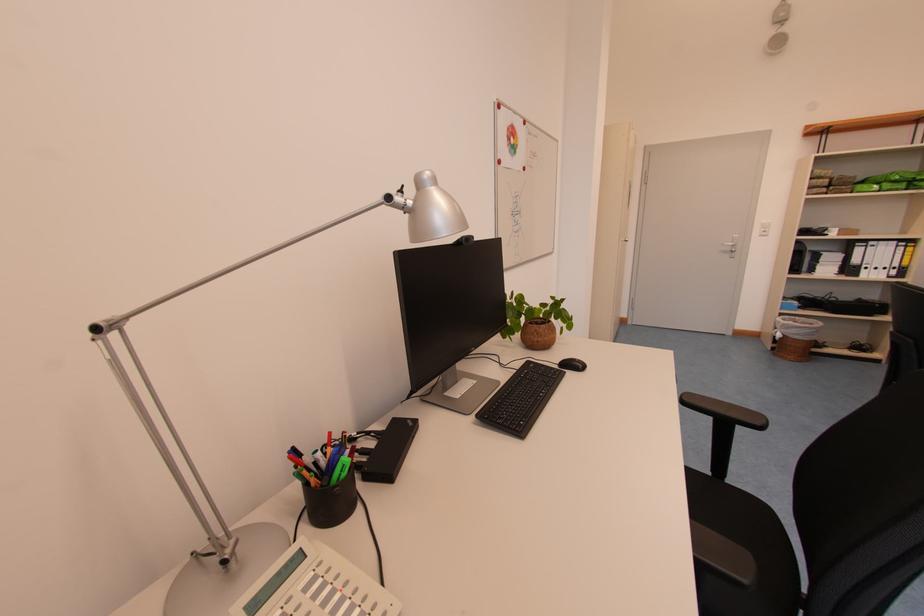
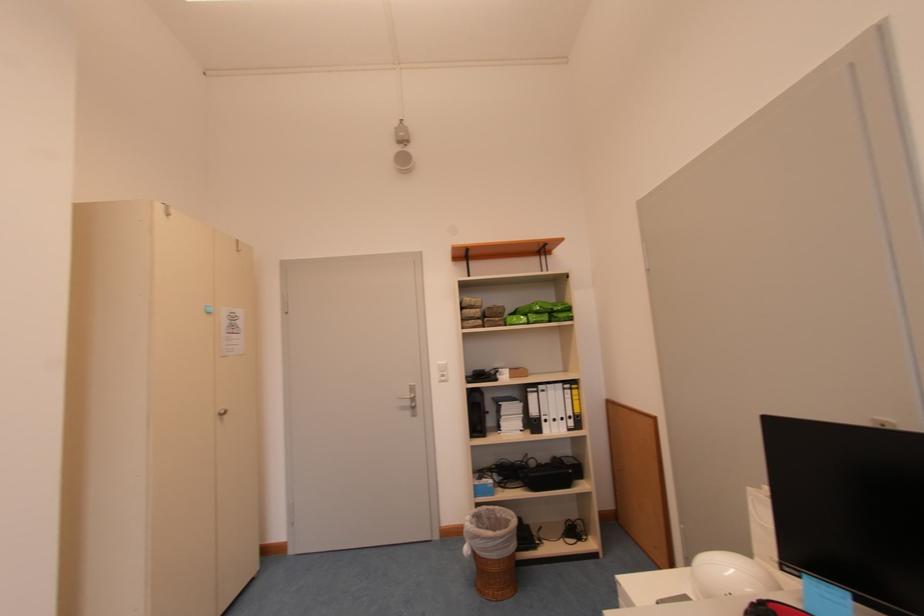
The point at (870,185) is marked in the first image. Where is the corresponding point in the second image?

(521, 315)